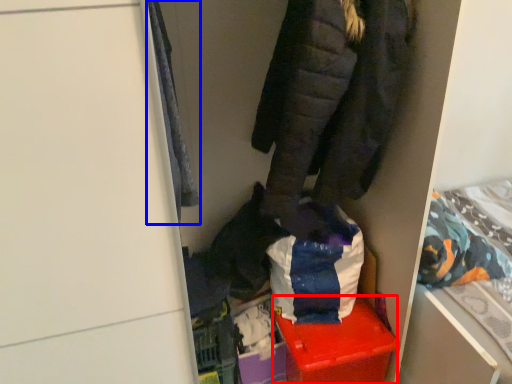
Question: Which of the following is the closest to the observer, storage box (highlighted by a red box) or cloak (highlighted by a blue box)?

Choices:
 (A) storage box
 (B) cloak

Answer: (B)